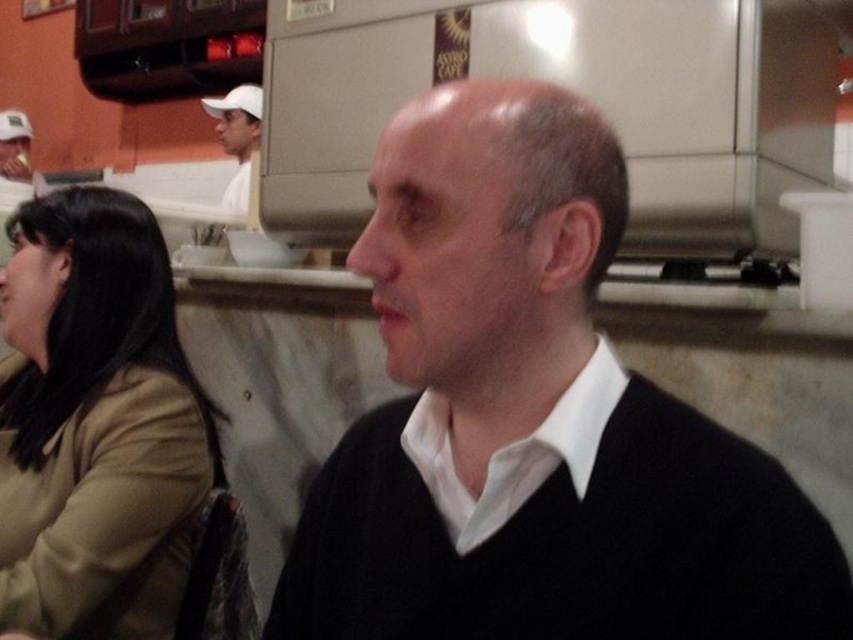
Question: Does black matte sweater at center come behind white cap at upper left?

Choices:
 (A) yes
 (B) no

Answer: (B)

Question: Where is tan fabric coat at left located in relation to matte white cap at upper left in the image?

Choices:
 (A) below
 (B) above

Answer: (A)

Question: Does black matte sweater at center appear on the left side of matte white cap at upper left?

Choices:
 (A) no
 (B) yes

Answer: (A)

Question: Which of the following is the farthest from the observer?

Choices:
 (A) matte white cap at upper left
 (B) black matte sweater at center
 (C) white cap at upper left

Answer: (A)

Question: Estimate the real-world distances between objects in this image. Which object is closer to the black matte sweater at center?

Choices:
 (A) white cap at upper left
 (B) matte white cap at upper left

Answer: (A)

Question: Based on their relative distances, which object is farther from the matte white cap at upper left?

Choices:
 (A) white cap at upper left
 (B) tan fabric coat at left
 (C) black matte sweater at center

Answer: (C)